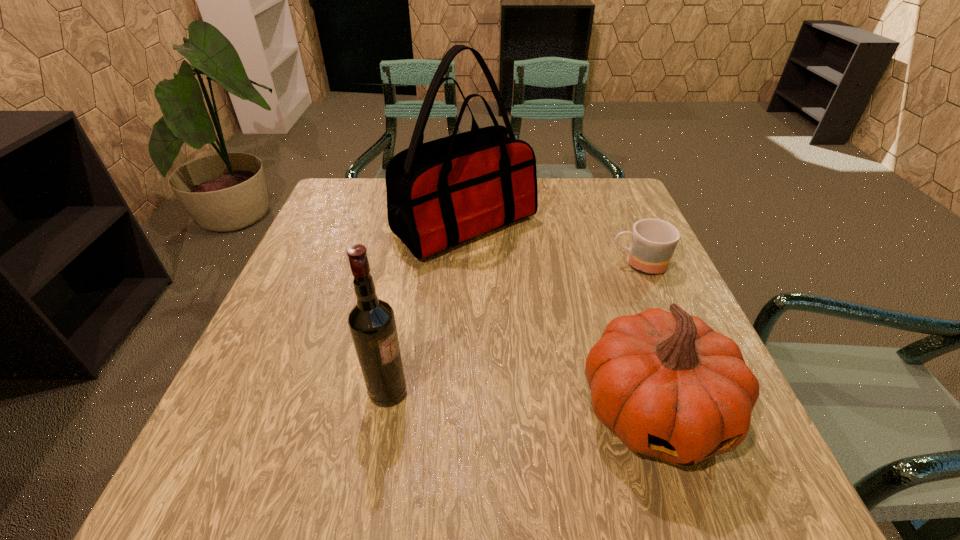
In order to click on the tallest object in this screenshot , I will do `click(440, 193)`.

Image resolution: width=960 pixels, height=540 pixels. In order to click on wine bottle in this screenshot , I will do `click(371, 321)`.

This screenshot has width=960, height=540. What are the coordinates of `pumpkin` in the screenshot? It's located at (669, 386).

Find the location of a particular element. This screenshot has width=960, height=540. the shortest object is located at coordinates (653, 242).

Find the location of `free space located 0.070m on the front of the duffel bag`. free space located 0.070m on the front of the duffel bag is located at coordinates (462, 287).

This screenshot has width=960, height=540. In order to click on vacant space located on the front and back of the third shortest object in this screenshot , I will do `click(594, 392)`.

At what (x,y) coordinates should I click in order to perform the action: click on vacant space located 0.120m on the side with the handle of the mug. Please return your answer as a coordinate pair (x, y). The image size is (960, 540). Looking at the image, I should click on (559, 263).

This screenshot has width=960, height=540. I want to click on vacant space positioned on the side with the handle of the mug, so click(x=470, y=263).

What are the coordinates of `vacant space located 0.220m on the side with the handle of the mug` in the screenshot? It's located at (516, 263).

Image resolution: width=960 pixels, height=540 pixels. I want to click on object present at the far edge, so click(440, 193).